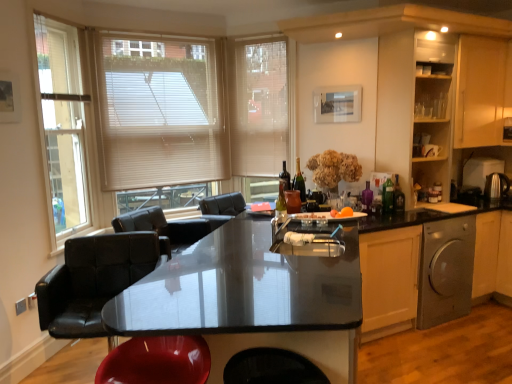
Question: Considering the relative sizes of glossy black countertop at center and green glass bottle at center in the image provided, is glossy black countertop at center taller than green glass bottle at center?

Choices:
 (A) no
 (B) yes

Answer: (B)

Question: From a real-world perspective, is glossy black countertop at center physically below green glass bottle at center?

Choices:
 (A) yes
 (B) no

Answer: (A)

Question: Considering the relative positions of glossy black countertop at center and green glass bottle at center in the image provided, is glossy black countertop at center to the left of green glass bottle at center from the viewer's perspective?

Choices:
 (A) yes
 (B) no

Answer: (A)

Question: Is glossy black countertop at center behind green glass bottle at center?

Choices:
 (A) yes
 (B) no

Answer: (B)

Question: Is the position of glossy black countertop at center less distant than that of green glass bottle at center?

Choices:
 (A) no
 (B) yes

Answer: (B)

Question: Is glossy black countertop at center wider than green glass bottle at center?

Choices:
 (A) no
 (B) yes

Answer: (B)

Question: Is matte wooden cabinet at right, which is the 2th cabinetry in right-to-left order, to the left of translucent glass bottle at center, acting as the second bottle starting from the back, from the viewer's perspective?

Choices:
 (A) no
 (B) yes

Answer: (A)

Question: From the image's perspective, would you say matte wooden cabinet at right, which is the 2th cabinetry in right-to-left order, is positioned over translucent glass bottle at center, which is counted as the 2th bottle, starting from the left?

Choices:
 (A) yes
 (B) no

Answer: (A)

Question: Does matte wooden cabinet at right, arranged as the first cabinetry when viewed from the left, have a larger size compared to translucent glass bottle at center, which is the second bottle from right to left?

Choices:
 (A) no
 (B) yes

Answer: (B)

Question: Is matte wooden cabinet at right, arranged as the first cabinetry when viewed from the left, thinner than translucent glass bottle at center, acting as the second bottle starting from the back?

Choices:
 (A) yes
 (B) no

Answer: (B)

Question: Can you confirm if matte wooden cabinet at right, which is the 2th cabinetry in right-to-left order, is positioned to the right of translucent glass bottle at center, which is counted as the 2th bottle, starting from the left?

Choices:
 (A) yes
 (B) no

Answer: (A)

Question: Can you confirm if matte wooden cabinet at right, arranged as the first cabinetry when viewed from the left, is wider than translucent glass bottle at center, which is counted as the 2th bottle, starting from the left?

Choices:
 (A) no
 (B) yes

Answer: (B)

Question: Is wooden cabinet at upper right, the 1th cabinetry in the right-to-left sequence, thinner than glossy black countertop at center?

Choices:
 (A) no
 (B) yes

Answer: (B)